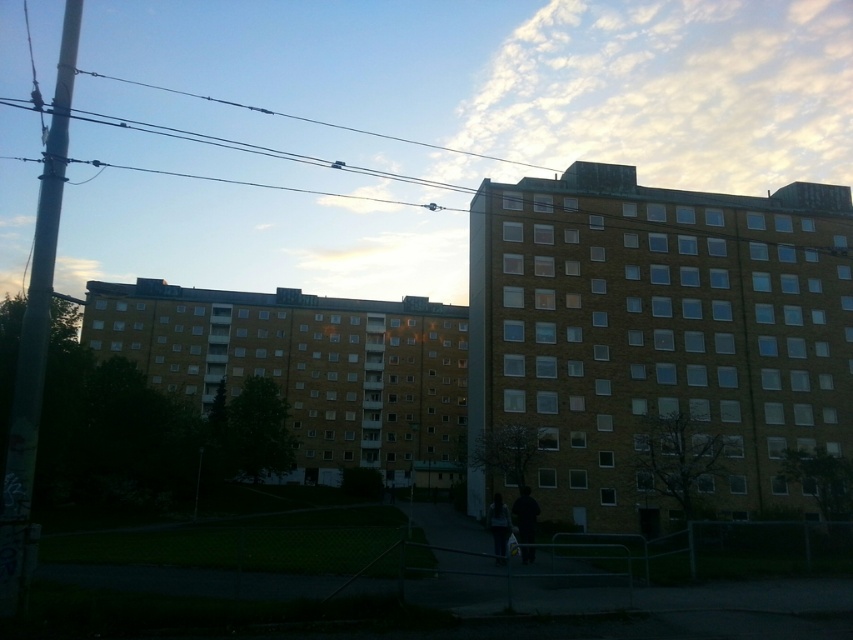
You are standing at the point marked by point [526,522] in an urban area with two residential buildings. The path in front of you leads to the buildings. If you walk straight ahead, will you reach the buildings before the path ends?

The distance between you and the buildings is 20.54 meters, so yes, you can reach the buildings before the path ends as long as the path is at least that long.

You are a delivery person standing at the entrance of the pathway leading to the residential buildings. You need to deliver a package to the person wearing both the dark gray fabric jacket at lower center and dark blue jeans at lower center. Based on the scene, can you determine if the jacket is shorter than the jeans?

The dark gray fabric jacket at lower center is not as tall as dark blue jeans at lower center, so yes, the jacket is shorter than the jeans.